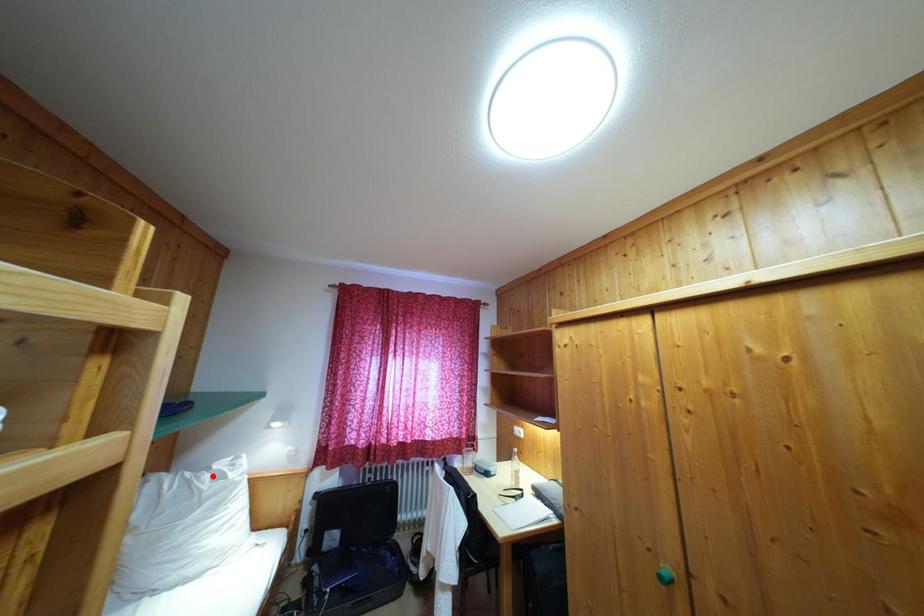
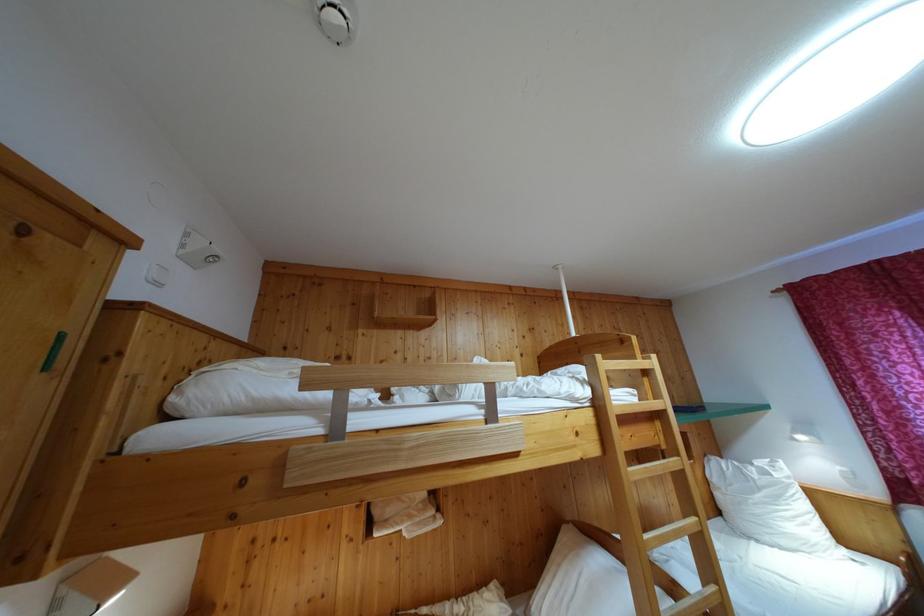
The point at the highlighted location is marked in the first image. Where is the corresponding point in the second image?

(755, 471)